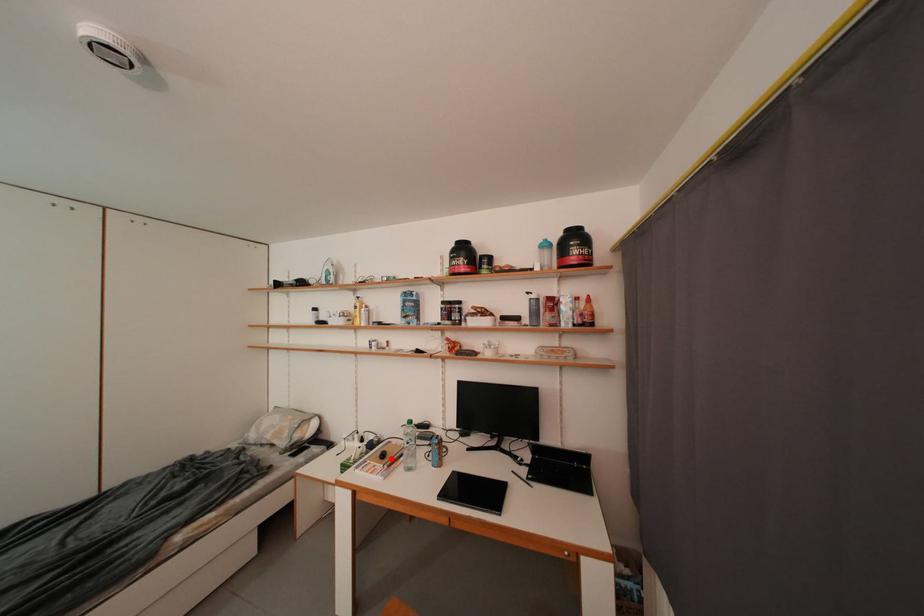
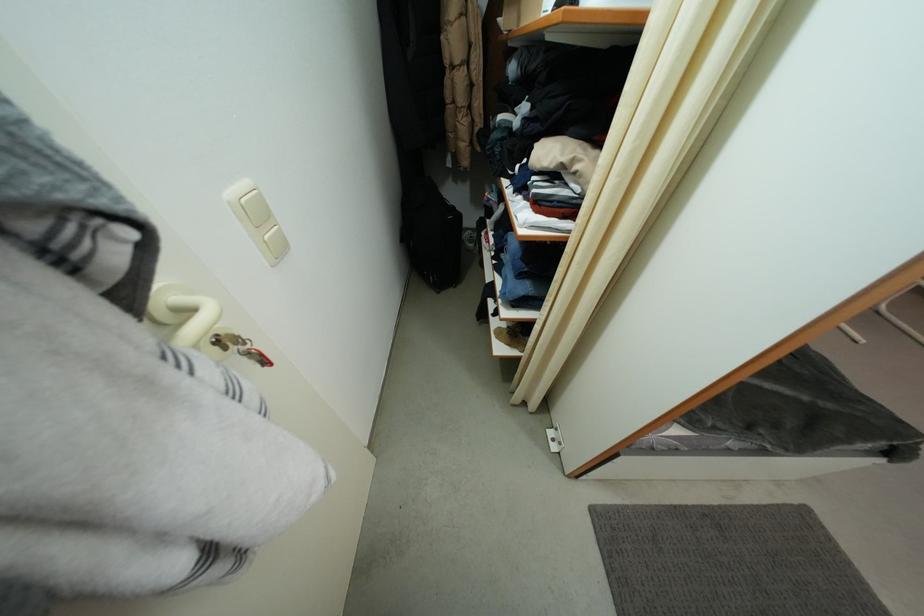
Question: I am providing you with two images of the same scene from different viewpoints. A red point is marked on the first image. Can you still see the location of the red point in image 2?

Choices:
 (A) Yes
 (B) No

Answer: (B)